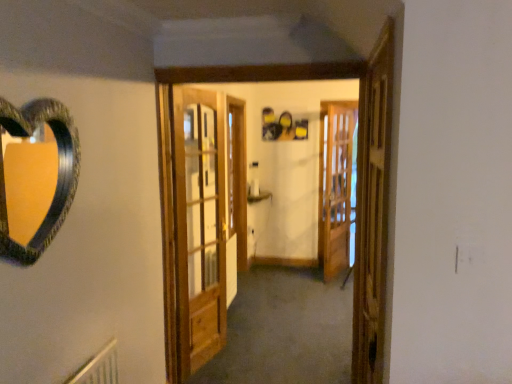
Question: Is wooden screen door at right, positioned as the 1th screen door in front-to-back order, shorter than wooden door at center?

Choices:
 (A) no
 (B) yes

Answer: (B)

Question: From a real-world perspective, does wooden screen door at right, the first screen door when ordered from left to right, stand above wooden door at center?

Choices:
 (A) yes
 (B) no

Answer: (A)

Question: Is wooden screen door at right, which is the second screen door from back to front, touching wooden door at center?

Choices:
 (A) yes
 (B) no

Answer: (B)

Question: Is wooden screen door at right, the 2th screen door from the right, positioned with its back to wooden door at center?

Choices:
 (A) yes
 (B) no

Answer: (B)

Question: From a real-world perspective, is wooden screen door at right, which is the second screen door from back to front, below wooden door at center?

Choices:
 (A) yes
 (B) no

Answer: (B)

Question: Can you confirm if wooden screen door at right, which is the second screen door from back to front, is wider than wooden door at center?

Choices:
 (A) no
 (B) yes

Answer: (A)

Question: Can you confirm if wooden screen door at right, the first screen door when ordered from left to right, is taller than wooden screen door at center, which is the 1th screen door in right-to-left order?

Choices:
 (A) yes
 (B) no

Answer: (B)

Question: Is wooden screen door at right, which is the second screen door from back to front, shorter than wooden screen door at center, acting as the 2th screen door starting from the left?

Choices:
 (A) yes
 (B) no

Answer: (A)

Question: Is wooden screen door at right, which is the second screen door from back to front, in contact with wooden screen door at center, which is the 1th screen door in right-to-left order?

Choices:
 (A) no
 (B) yes

Answer: (A)

Question: Is wooden screen door at right, positioned as the 1th screen door in front-to-back order, looking in the opposite direction of wooden screen door at center, which is the 1th screen door in right-to-left order?

Choices:
 (A) yes
 (B) no

Answer: (B)

Question: Is wooden screen door at right, which is the second screen door from back to front, closer to the viewer compared to wooden screen door at center, which is the 1th screen door in right-to-left order?

Choices:
 (A) no
 (B) yes

Answer: (B)

Question: From the image's perspective, would you say wooden screen door at right, the first screen door when ordered from left to right, is positioned over wooden screen door at center, the first screen door positioned from the back?

Choices:
 (A) yes
 (B) no

Answer: (B)

Question: Considering the relative sizes of wooden screen door at center, marked as the second screen door in a front-to-back arrangement, and wooden door at center in the image provided, is wooden screen door at center, marked as the second screen door in a front-to-back arrangement, thinner than wooden door at center?

Choices:
 (A) no
 (B) yes

Answer: (B)